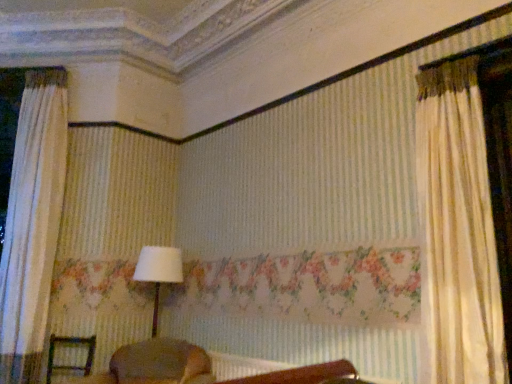
Question: From the image's perspective, relative to white fabric lampshade at center, is wooden chair at lower left above or below?

Choices:
 (A) below
 (B) above

Answer: (A)

Question: Considering their positions, is wooden chair at lower left located in front of or behind white fabric lampshade at center?

Choices:
 (A) behind
 (B) front

Answer: (B)

Question: Is wooden chair at lower left bigger or smaller than white fabric lampshade at center?

Choices:
 (A) small
 (B) big

Answer: (A)

Question: In the image, is white fabric lampshade at center positioned in front of or behind wooden chair at lower left?

Choices:
 (A) behind
 (B) front

Answer: (A)

Question: In terms of height, does white fabric lampshade at center look taller or shorter compared to wooden chair at lower left?

Choices:
 (A) tall
 (B) short

Answer: (A)

Question: From the image's perspective, is white fabric lampshade at center positioned above or below wooden chair at lower left?

Choices:
 (A) above
 (B) below

Answer: (A)

Question: Which is correct: white fabric lampshade at center is inside wooden chair at lower left, or outside of it?

Choices:
 (A) outside
 (B) inside

Answer: (A)